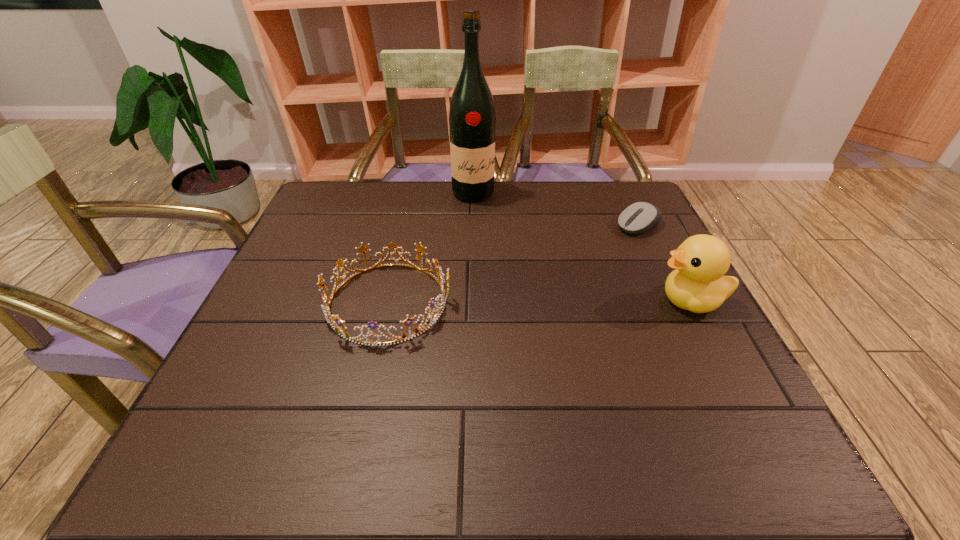
Identify the location of vacant space located 0.330m on the front-facing side of the tallest object. (524, 275).

Locate an element on the screen. The width and height of the screenshot is (960, 540). vacant space positioned 0.400m on the front-facing side of the tallest object is located at coordinates (537, 294).

I want to click on vacant region located 0.120m on the front-facing side of the tallest object, so (493, 227).

Find the location of a particular element. vacant space located on the wheel side of the computer equipment is located at coordinates (543, 281).

The height and width of the screenshot is (540, 960). What are the coordinates of `blank area located on the wheel side of the computer equipment` in the screenshot? It's located at click(570, 265).

I want to click on vacant space located 0.270m on the wheel side of the computer equipment, so click(553, 276).

Locate an element on the screen. liquor that is positioned at the far edge is located at coordinates (472, 120).

Locate an element on the screen. The height and width of the screenshot is (540, 960). computer equipment located in the far edge section of the desktop is located at coordinates (639, 217).

Find the location of `object located at the left edge`. object located at the left edge is located at coordinates (339, 328).

Locate an element on the screen. This screenshot has height=540, width=960. duck that is at the right edge is located at coordinates (697, 284).